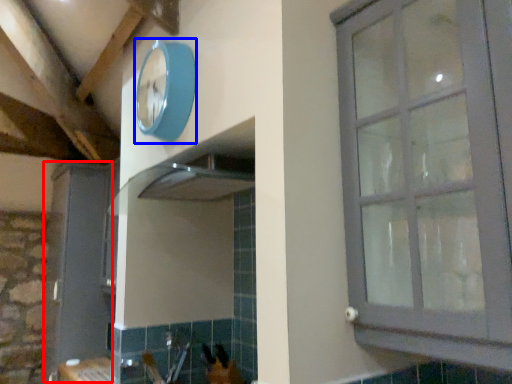
Question: Among these objects, which one is farthest to the camera, screen door (highlighted by a red box) or clock (highlighted by a blue box)?

Choices:
 (A) screen door
 (B) clock

Answer: (A)